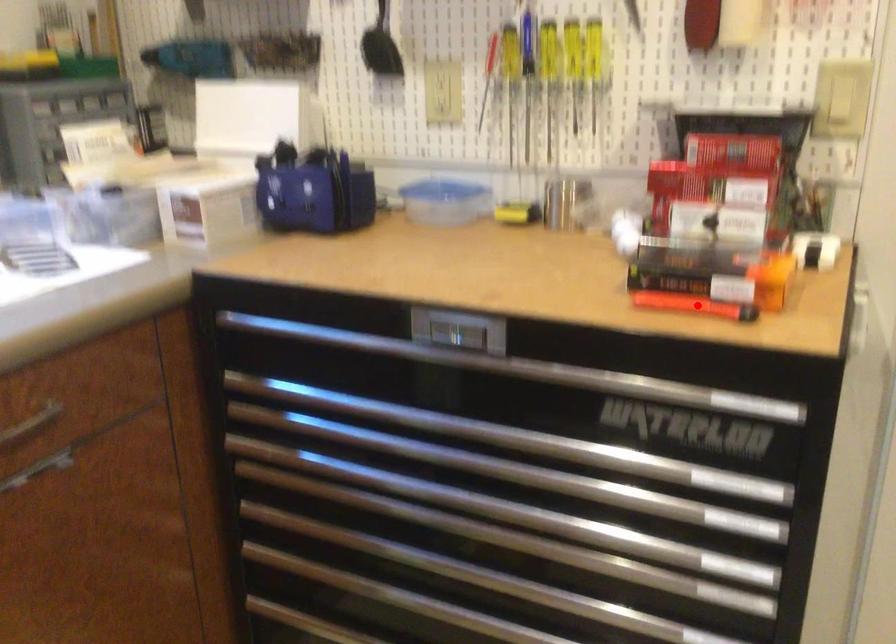
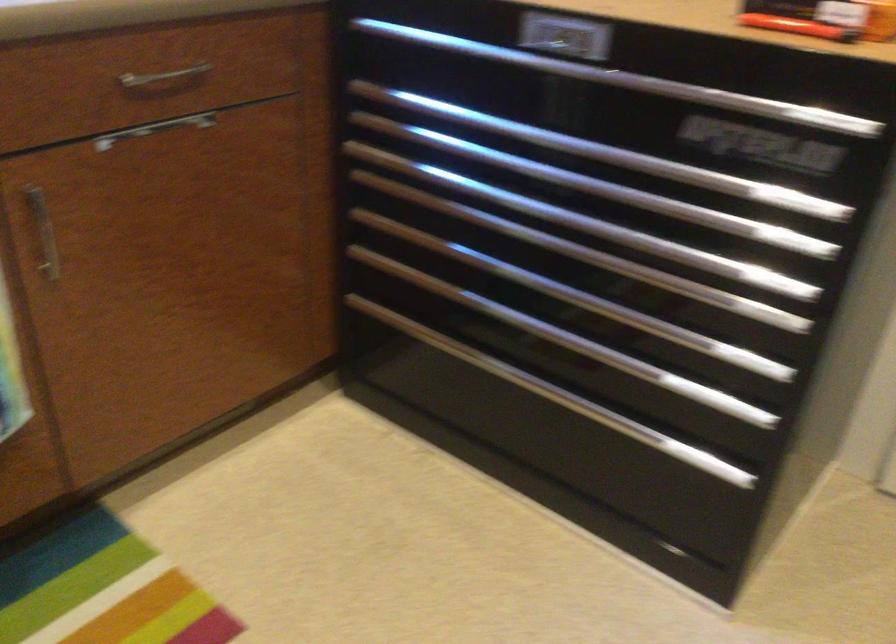
Question: I am providing you with two images of the same scene from different viewpoints. A red point is marked on the first image. Is the red point's position out of view in image 2?

Choices:
 (A) Yes
 (B) No

Answer: (B)